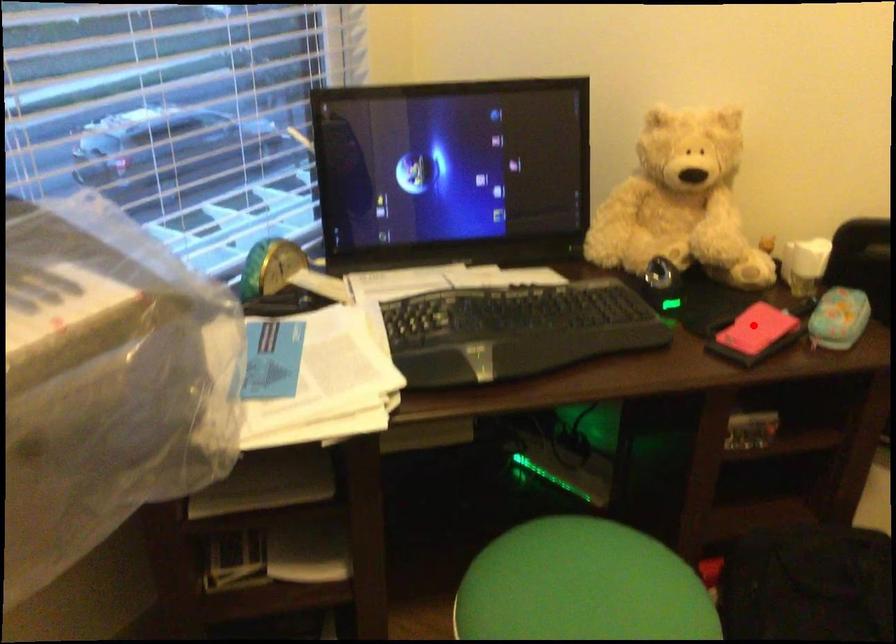
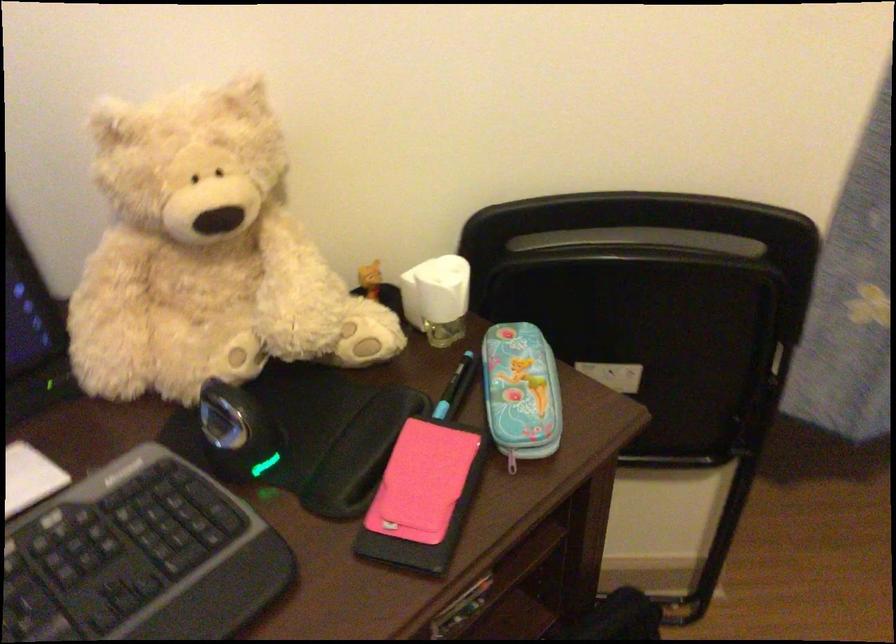
Question: I am providing you with two images of the same scene from different viewpoints. Given a red point in image1, look at the same physical point in image2. Is it:

Choices:
 (A) Closer to the viewpoint
 (B) Farther from the viewpoint

Answer: (A)